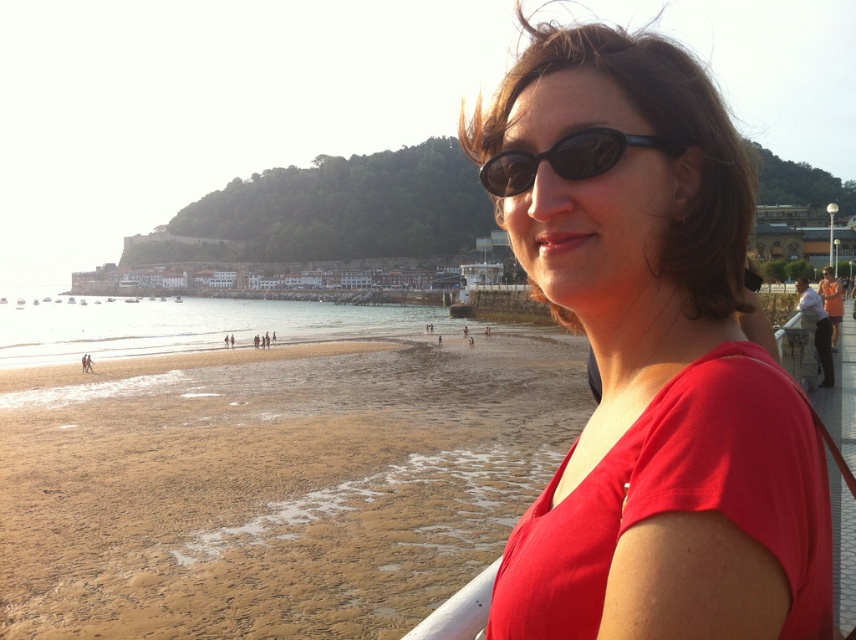
Between matte red shirt at center and sunglasses at center, which one appears on the left side from the viewer's perspective?

sunglasses at center

The image size is (856, 640). I want to click on matte red shirt at center, so click(x=651, y=358).

Does point (281, 316) lie behind point (491, 173)?

Yes, point (281, 316) is behind point (491, 173).

Measure the distance between point (405, 388) and camera.

Point (405, 388) is 163.69 feet away from camera.

At what (x,y) coordinates should I click in order to perform the action: click on sandy beach at lower left. Please return your answer as a coordinate pair (x, y). This screenshot has height=640, width=856. Looking at the image, I should click on (269, 470).

Does point (496, 355) come behind point (527, 522)?

Yes.

Is sandy beach at lower left below matte red shirt at center?

Yes.

Image resolution: width=856 pixels, height=640 pixels. What are the coordinates of `sandy beach at lower left` in the screenshot? It's located at (269, 470).